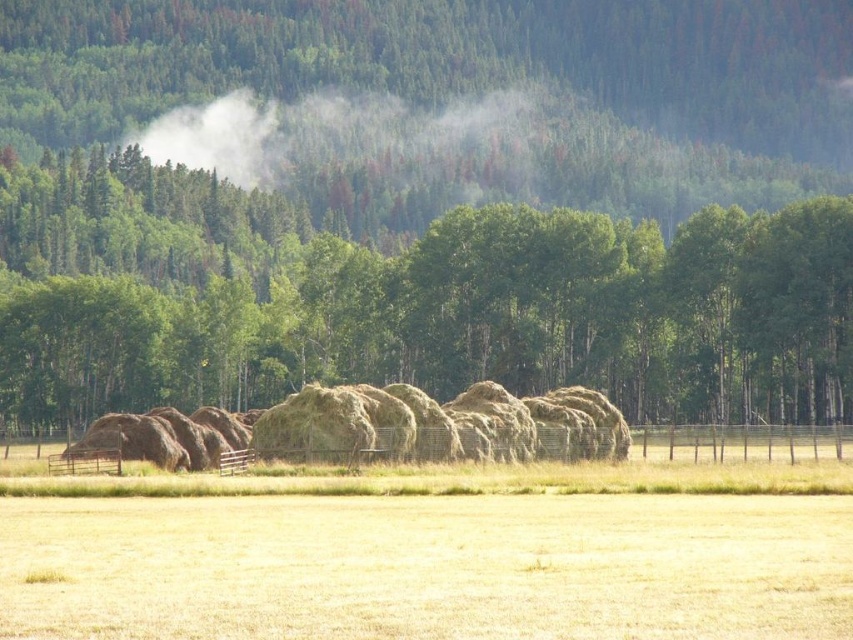
Is dry grass at center above white foggy cloud at upper center?

Incorrect, dry grass at center is not positioned above white foggy cloud at upper center.

Identify the location of dry grass at center. This screenshot has height=640, width=853. (434, 552).

Describe the element at coordinates (410, 301) in the screenshot. Image resolution: width=853 pixels, height=640 pixels. I see `green leafy tree at center` at that location.

Based on the photo, between green leafy tree at center and white foggy cloud at upper center, which one appears on the left side from the viewer's perspective?

white foggy cloud at upper center

Between point (714, 289) and point (235, 170), which one is positioned in front?

Positioned in front is point (714, 289).

The height and width of the screenshot is (640, 853). In order to click on green leafy tree at center in this screenshot , I will do `click(410, 301)`.

Which of these two, green leafy tree at center or dry grass at center, stands shorter?

dry grass at center is shorter.

Who is more forward, (532, 209) or (123, 628)?

Positioned in front is point (123, 628).

You are a GUI agent. You are given a task and a screenshot of the screen. Output one action in this format:
    pyautogui.click(x=<x>, y=<y>)
    Task: Click on the green leafy tree at center
    The height and width of the screenshot is (640, 853).
    Given the screenshot: What is the action you would take?
    pyautogui.click(x=410, y=301)